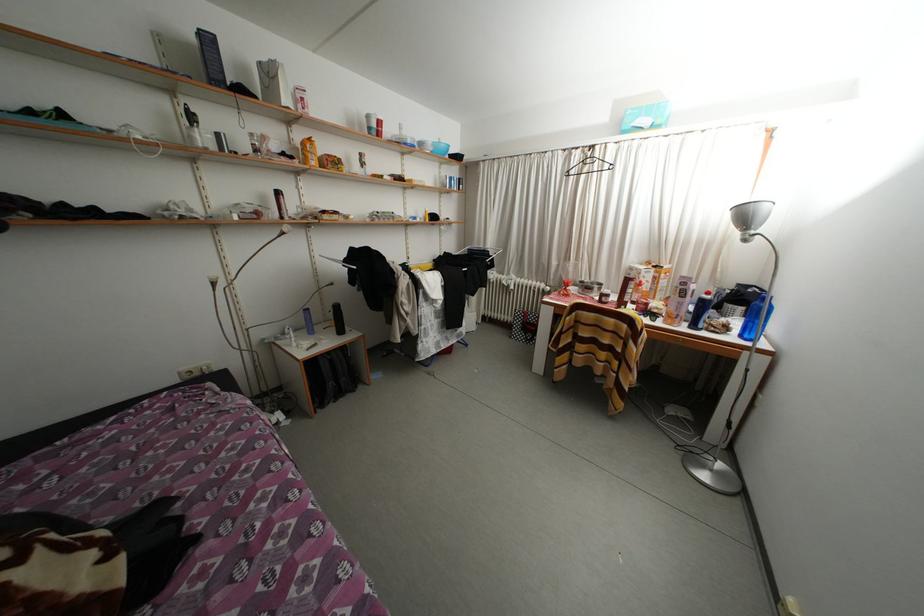
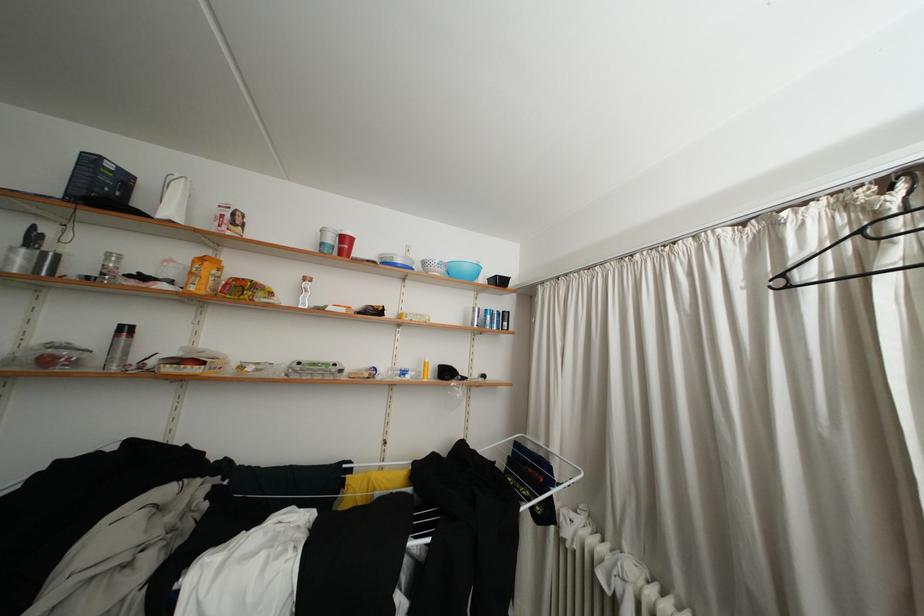
Find the pixel in the second image that matches the point at 596,166 in the first image.

(906, 229)